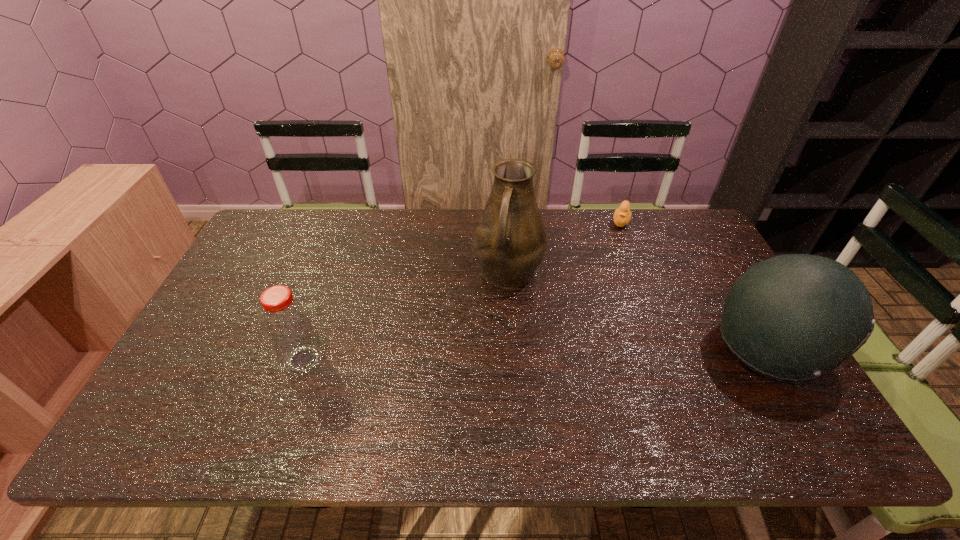
Identify the location of object positioned at the near right corner. The image size is (960, 540). (794, 317).

This screenshot has width=960, height=540. In the image, there is a desktop. What are the coordinates of `vacant space at the far edge` in the screenshot? It's located at (632, 237).

Where is `vacant space at the near edge of the desktop`? The image size is (960, 540). vacant space at the near edge of the desktop is located at coordinates click(519, 407).

In the image, there is a desktop. Identify the location of vacant space at the right edge. (719, 273).

In the image, there is a desktop. Identify the location of free region at the far right corner. (654, 211).

Find the location of `vacant space that's between the leftmost object and the shortest object`. vacant space that's between the leftmost object and the shortest object is located at coordinates (462, 291).

Locate an element on the screen. Image resolution: width=960 pixels, height=540 pixels. unoccupied position between the duckling and the second farthest object is located at coordinates (564, 247).

Where is `free area in between the bottle and the second tallest object`? free area in between the bottle and the second tallest object is located at coordinates (536, 355).

Find the location of a particular element. blank region between the duckling and the football helmet is located at coordinates (694, 285).

You are a GUI agent. You are given a task and a screenshot of the screen. Output one action in this format:
    pyautogui.click(x=<x>, y=<y>)
    Task: Click on the unoccupied area between the second shortest object and the duckling
    This screenshot has height=540, width=960.
    Given the screenshot: What is the action you would take?
    pyautogui.click(x=462, y=291)